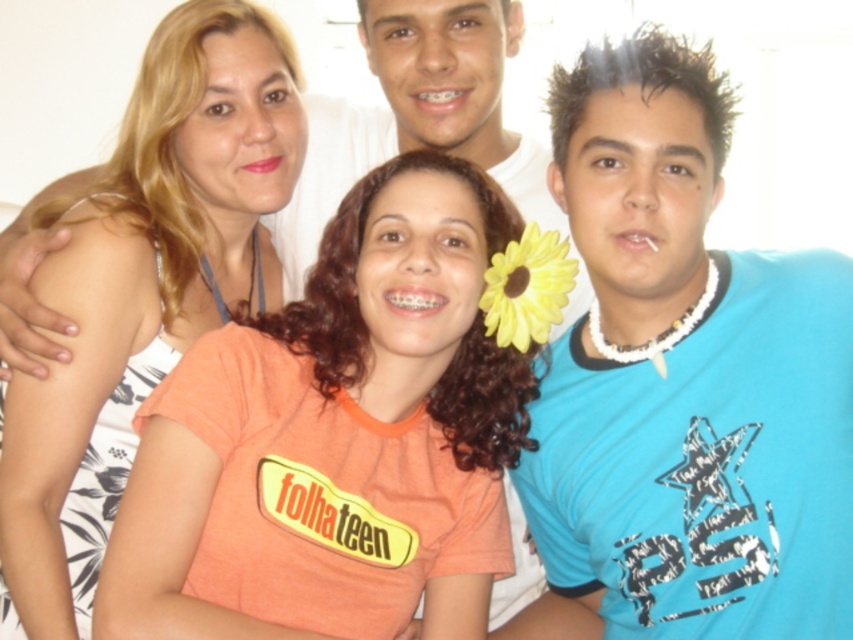
Question: In this image, where is blue printed t-shirt at center located relative to orange cotton t-shirt at center?

Choices:
 (A) left
 (B) right

Answer: (B)

Question: Considering the relative positions of blue printed t-shirt at center and matte orange t-shirt at center in the image provided, where is blue printed t-shirt at center located with respect to matte orange t-shirt at center?

Choices:
 (A) above
 (B) below

Answer: (B)

Question: Which point is closer to the camera?

Choices:
 (A) matte orange t-shirt at center
 (B) yellow fabric flower at center
 (C) blue printed t-shirt at center
 (D) orange cotton t-shirt at center

Answer: (D)

Question: Can you confirm if orange cotton t-shirt at center is bigger than yellow fabric flower at center?

Choices:
 (A) yes
 (B) no

Answer: (A)

Question: Which point is closer to the camera?

Choices:
 (A) orange cotton t-shirt at center
 (B) yellow fabric flower at center

Answer: (A)

Question: Which object appears closest to the camera in this image?

Choices:
 (A) orange cotton t-shirt at center
 (B) matte orange t-shirt at center
 (C) yellow fabric flower at center

Answer: (A)